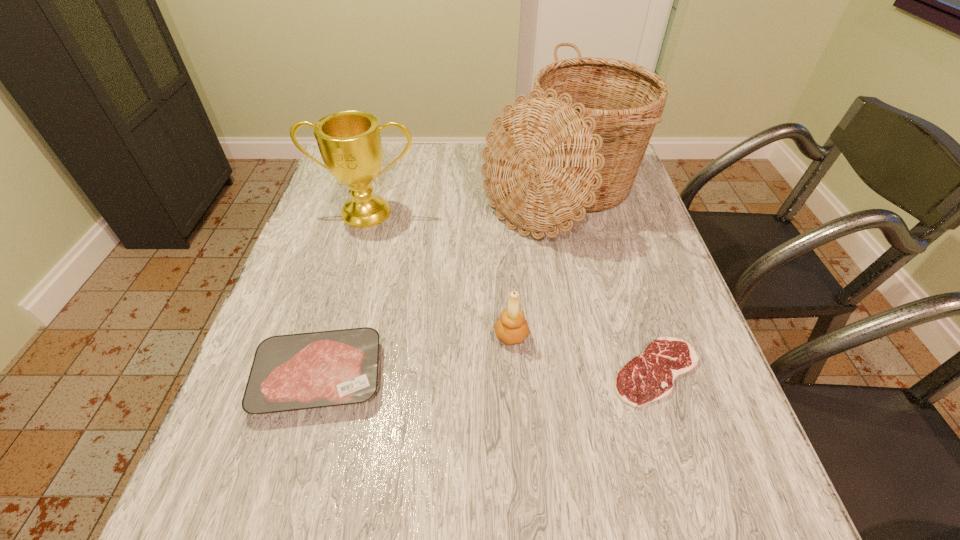
You are a GUI agent. You are given a task and a screenshot of the screen. Output one action in this format:
    pyautogui.click(x=<x>, y=<y>)
    Task: Click on the vacant point located between the taller steak and the fourth shortest object
    
    Given the screenshot: What is the action you would take?
    pyautogui.click(x=344, y=294)

Find the location of a particular element. This screenshot has width=960, height=540. object that can be found as the third closest to the left steak is located at coordinates (349, 142).

The image size is (960, 540). I want to click on object identified as the second closest to the tallest object, so click(x=512, y=328).

This screenshot has width=960, height=540. Identify the location of free space in the image that satisfies the following two spatial constraints: 1. on the shiny surface of the second tallest object; 2. on the right side of the shorter steak. (323, 372).

Image resolution: width=960 pixels, height=540 pixels. Find the location of `vacant position in the image that satisfies the following two spatial constraints: 1. on the front side of the shorter steak; 2. on the left side of the tallest object`. vacant position in the image that satisfies the following two spatial constraints: 1. on the front side of the shorter steak; 2. on the left side of the tallest object is located at coordinates (598, 372).

The height and width of the screenshot is (540, 960). What are the coordinates of `blank space that satisfies the following two spatial constraints: 1. on the shiny surface of the third shortest object; 2. on the right side of the fourth shortest object` in the screenshot? It's located at (333, 335).

Where is `free region that satisfies the following two spatial constraints: 1. on the shiny surface of the award; 2. on the right side of the shorter steak`? This screenshot has width=960, height=540. free region that satisfies the following two spatial constraints: 1. on the shiny surface of the award; 2. on the right side of the shorter steak is located at coordinates (323, 372).

Locate an element on the screen. The width and height of the screenshot is (960, 540). vacant space that satisfies the following two spatial constraints: 1. on the back side of the basket; 2. on the left side of the left steak is located at coordinates (372, 192).